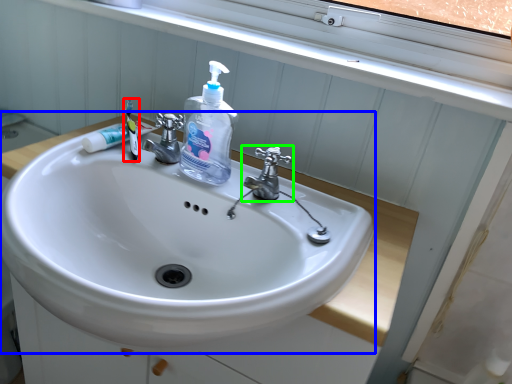
Question: Estimate the real-world distances between objects in this image. Which object is farther from toothbrush (highlighted by a red box), sink (highlighted by a blue box) or tap (highlighted by a green box)?

Choices:
 (A) sink
 (B) tap

Answer: (B)